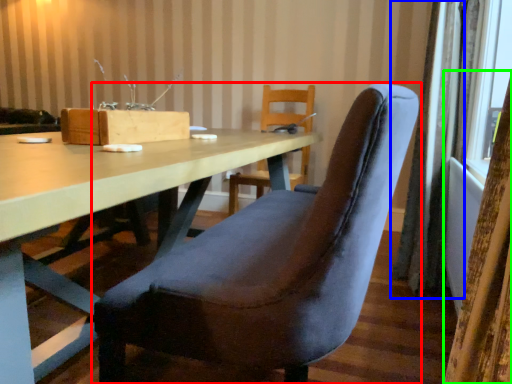
Question: Which object is the closest to the chair (highlighted by a red box)? Choose among these: curtain (highlighted by a blue box) or curtain (highlighted by a green box).

Choices:
 (A) curtain
 (B) curtain

Answer: (B)